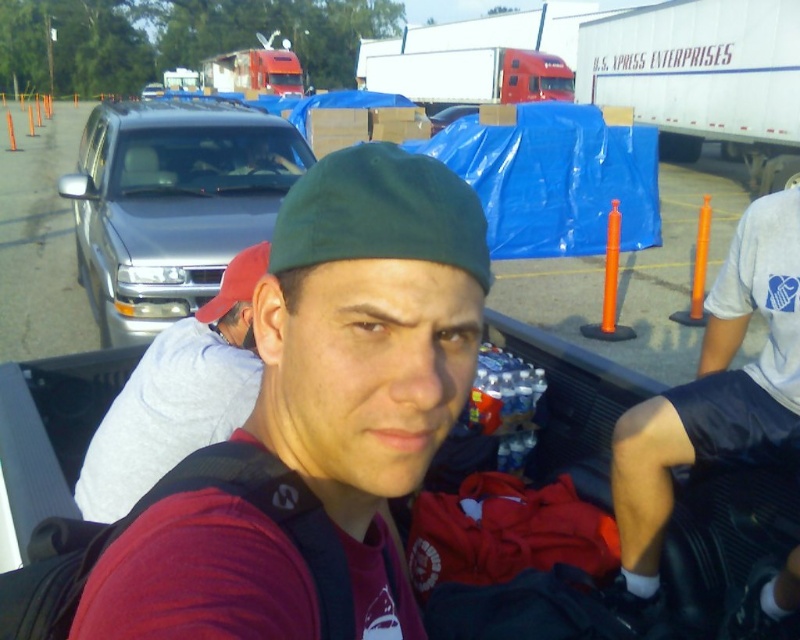
Question: Which point is closer to the camera?

Choices:
 (A) (234, 140)
 (B) (128, 196)
 (C) (230, 268)

Answer: (C)

Question: Does matte red shirt at center appear on the right side of red fabric cap at center?

Choices:
 (A) no
 (B) yes

Answer: (B)

Question: Is the position of white cotton shorts at lower right more distant than that of white matte trailer truck at upper right?

Choices:
 (A) yes
 (B) no

Answer: (B)

Question: Is gray cotton shirt at left wider than matte black truck driver at upper center?

Choices:
 (A) yes
 (B) no

Answer: (B)

Question: Which of the following is the closest to the observer?

Choices:
 (A) 248,168
 (B) 686,51
 (C) 202,392

Answer: (C)

Question: Which object is the farthest from the red fabric cap at center?

Choices:
 (A) satin silver van at left
 (B) white cotton shorts at lower right
 (C) gray cotton shirt at left

Answer: (A)